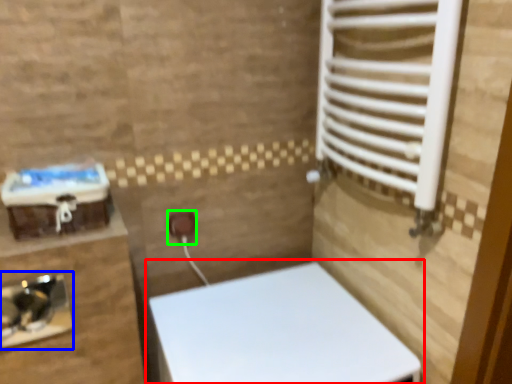
Question: Which is farther away from toilet (highlighted by a red box)? sink (highlighted by a blue box) or electric outlet (highlighted by a green box)?

Choices:
 (A) sink
 (B) electric outlet

Answer: (A)